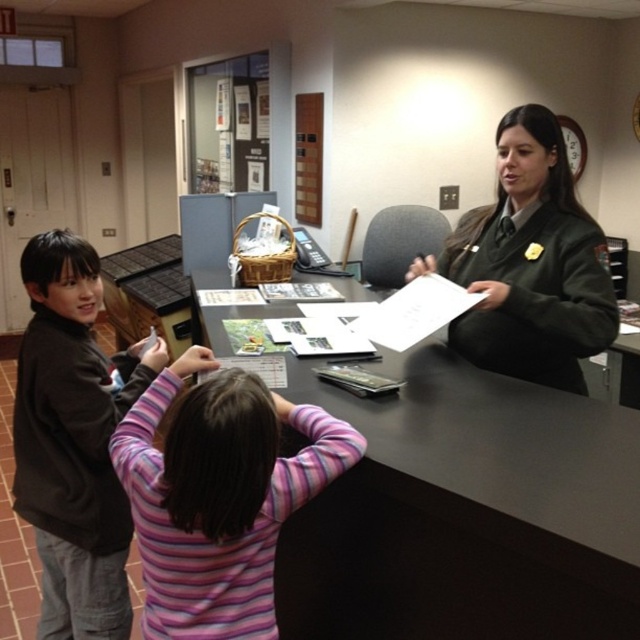
You are a visitor at the reception desk and need to hand a form to the adult. The form must be placed precisely at point 0.7 on the x and 0.3 on the y coordinates. Can you determine if the striped sweater at center is close enough to the target point to ensure the adult can easily reach it?

The striped sweater at center is located at point (x=218, y=496), which is within a reasonable proximity to the target coordinates (x=192, y=448). The adult can easily reach it from that position.

Looking at this image, you are a visitor at the reception desk and see two children in the foreground. Which child is wearing the striped sweater at center located to the left of the green uniform at center?

The striped sweater at center is to the left of the green uniform at center, so the child wearing the striped sweater at center is positioned to the left of the one in the green uniform at center.

You are a tailor measuring sweaters for a store display. You have two sweaters to arrange on a shelf. The striped sweater at center and the brown soft sweater at left. Which sweater should you place first if you want to fit both on the shelf starting from the left side?

You should place the brown soft sweater at left first since it is narrower than the striped sweater at center, allowing both to fit on the shelf when starting from the left side.